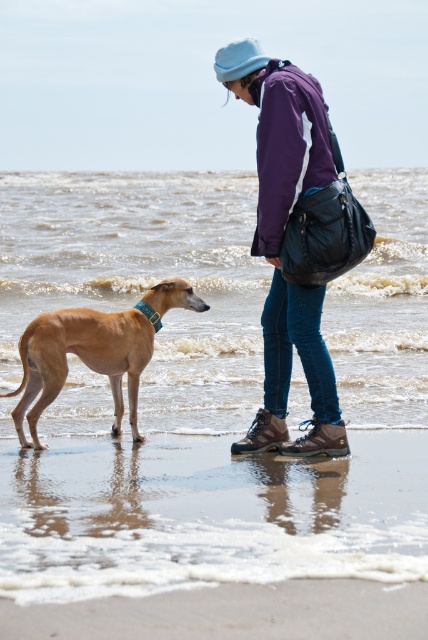
Question: Which point is closer to the camera taking this photo?

Choices:
 (A) (15, 417)
 (B) (318, 115)
 (C) (410, 508)

Answer: (C)

Question: Which of the following is the farthest from the observer?

Choices:
 (A) purple matte jacket at center
 (B) smooth sand at lower center
 (C) brown smooth dog at lower left

Answer: (C)

Question: Does purple matte jacket at center appear on the left side of brown smooth dog at lower left?

Choices:
 (A) yes
 (B) no

Answer: (B)

Question: Does purple matte jacket at center have a larger size compared to brown smooth dog at lower left?

Choices:
 (A) yes
 (B) no

Answer: (A)

Question: Which point is closer to the camera?

Choices:
 (A) (160, 282)
 (B) (80, 500)
 (C) (276, 278)

Answer: (B)

Question: Can you confirm if smooth sand at lower center is positioned below brown smooth dog at lower left?

Choices:
 (A) no
 (B) yes

Answer: (B)